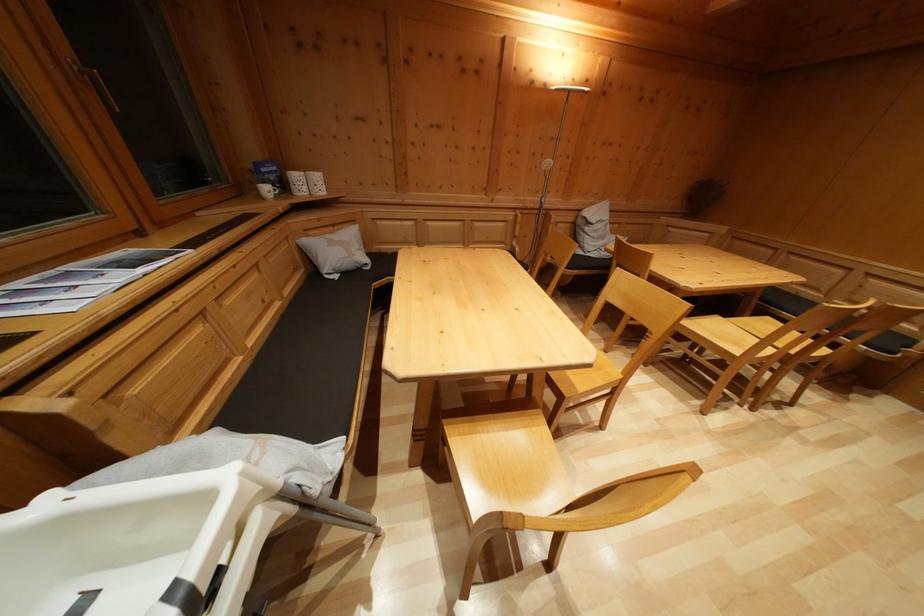
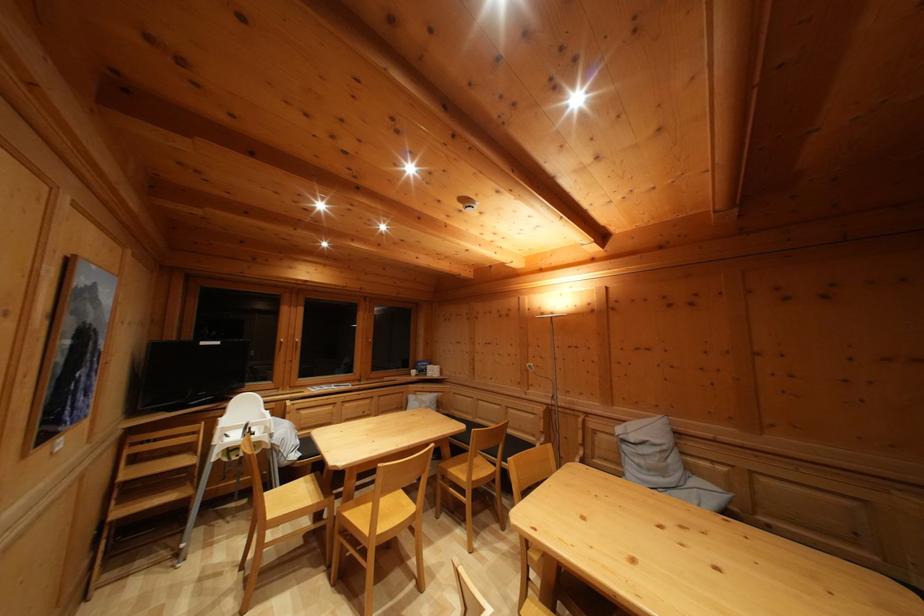
Where in the second image is the point corresponding to pixel 591 235 from the first image?

(629, 454)